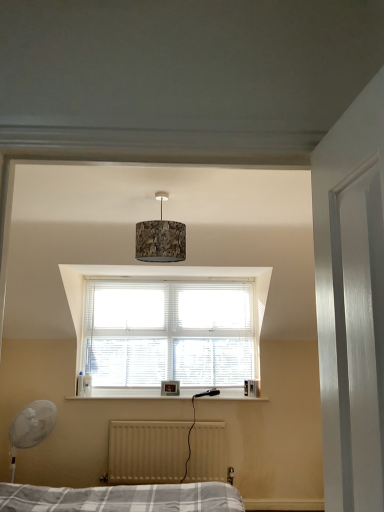
Question: Does textured cork lampshade at center turn towards white plastic fan at lower left?

Choices:
 (A) no
 (B) yes

Answer: (A)

Question: Can you confirm if textured cork lampshade at center is taller than white plastic fan at lower left?

Choices:
 (A) yes
 (B) no

Answer: (B)

Question: Is textured cork lampshade at center closer to the viewer compared to white plastic fan at lower left?

Choices:
 (A) no
 (B) yes

Answer: (B)

Question: Does textured cork lampshade at center appear on the left side of white plastic fan at lower left?

Choices:
 (A) no
 (B) yes

Answer: (A)

Question: Does textured cork lampshade at center have a lesser height compared to white plastic fan at lower left?

Choices:
 (A) yes
 (B) no

Answer: (A)

Question: Considering their positions, is white matte radiator at lower center located in front of or behind textured cork lampshade at center?

Choices:
 (A) front
 (B) behind

Answer: (B)

Question: From the image's perspective, is white matte radiator at lower center above or below textured cork lampshade at center?

Choices:
 (A) below
 (B) above

Answer: (A)

Question: From a real-world perspective, is white matte radiator at lower center above or below textured cork lampshade at center?

Choices:
 (A) below
 (B) above

Answer: (A)

Question: Does point (198, 466) appear closer or farther from the camera than point (152, 232)?

Choices:
 (A) farther
 (B) closer

Answer: (A)

Question: Which is correct: white plastic fan at lower left is inside white matte radiator at lower center, or outside of it?

Choices:
 (A) inside
 (B) outside

Answer: (B)

Question: Considering the positions of white plastic fan at lower left and white matte radiator at lower center in the image, is white plastic fan at lower left taller or shorter than white matte radiator at lower center?

Choices:
 (A) short
 (B) tall

Answer: (B)

Question: Considering the positions of point (13, 465) and point (127, 453), is point (13, 465) closer or farther from the camera than point (127, 453)?

Choices:
 (A) farther
 (B) closer

Answer: (B)

Question: In the image, is white plastic fan at lower left positioned in front of or behind white matte radiator at lower center?

Choices:
 (A) behind
 (B) front

Answer: (B)

Question: Which is correct: white plastic fan at lower left is inside textured cork lampshade at center, or outside of it?

Choices:
 (A) inside
 (B) outside

Answer: (B)

Question: Is point (29, 435) closer or farther from the camera than point (152, 254)?

Choices:
 (A) closer
 (B) farther

Answer: (B)